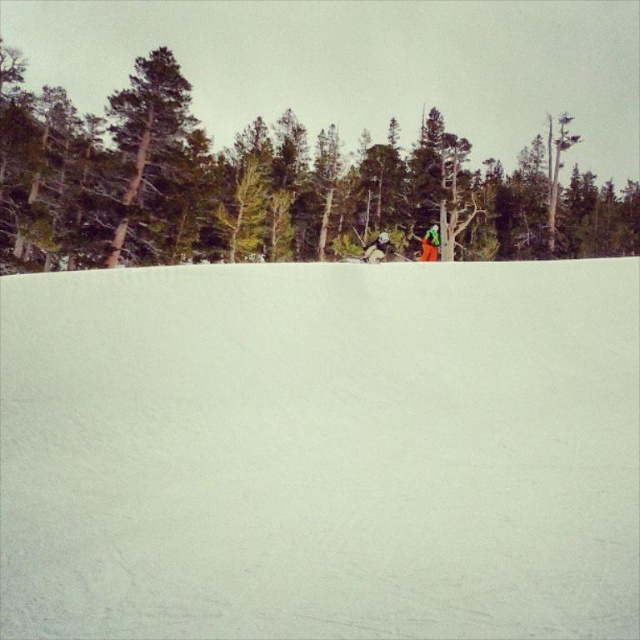
Question: Is white snow at center smaller than green fabric jacket at center?

Choices:
 (A) yes
 (B) no

Answer: (A)

Question: Is green matte tree at upper center smaller than green fabric jacket at center?

Choices:
 (A) yes
 (B) no

Answer: (B)

Question: Which object is farther from the camera taking this photo?

Choices:
 (A) white snow at center
 (B) green matte tree at upper center

Answer: (B)

Question: Considering the real-world distances, which object is closest to the green fabric jacket at center?

Choices:
 (A) white snow at center
 (B) green matte tree at upper center

Answer: (A)

Question: Does green matte tree at upper center appear on the left side of green fabric jacket at center?

Choices:
 (A) no
 (B) yes

Answer: (A)

Question: Which is nearer to the green matte tree at upper center?

Choices:
 (A) green fabric jacket at center
 (B) white snow at center

Answer: (A)